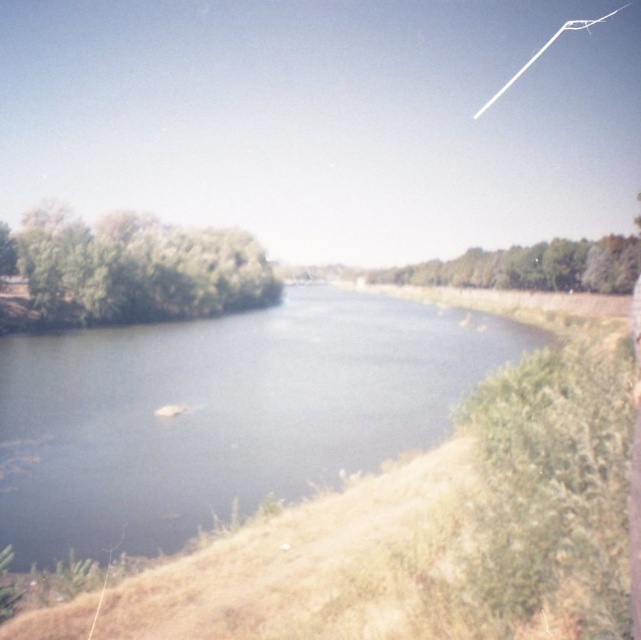
From the picture: You are standing at the edge of the scene and want to reach the green leafy trees at center. Which direction should you move relative to the blue water at center?

Since the blue water at center is closer to the viewer than the green leafy trees at center, you should move away from the blue water at center to reach the green leafy trees at center.

You are standing at the point marked as point (222,413) in the image. What is the nearest object to you in the scene?

The nearest object to you at point (222,413) is the blue water at center.